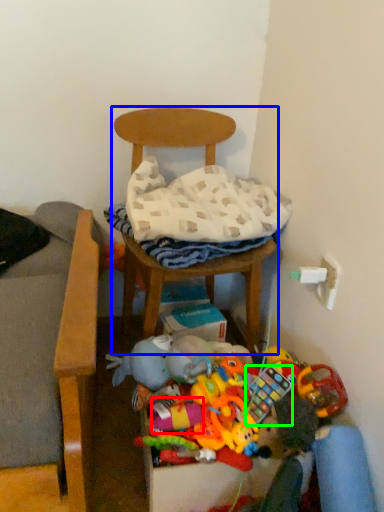
Question: Which object is positioned closest to toy (highlighted by a red box)? Select from chair (highlighted by a blue box) and toy (highlighted by a green box).

Choices:
 (A) chair
 (B) toy

Answer: (B)